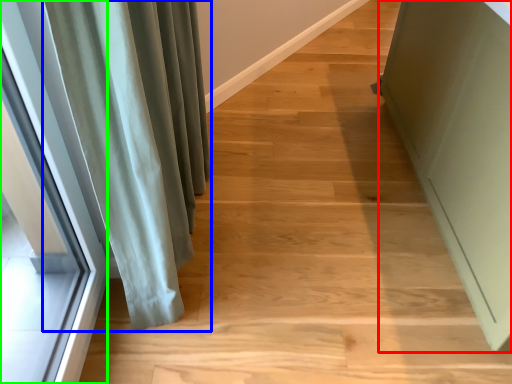
Question: Which is nearer to the screen door (highlighted by a red box)? curtain (highlighted by a blue box) or window (highlighted by a green box).

Choices:
 (A) curtain
 (B) window

Answer: (A)